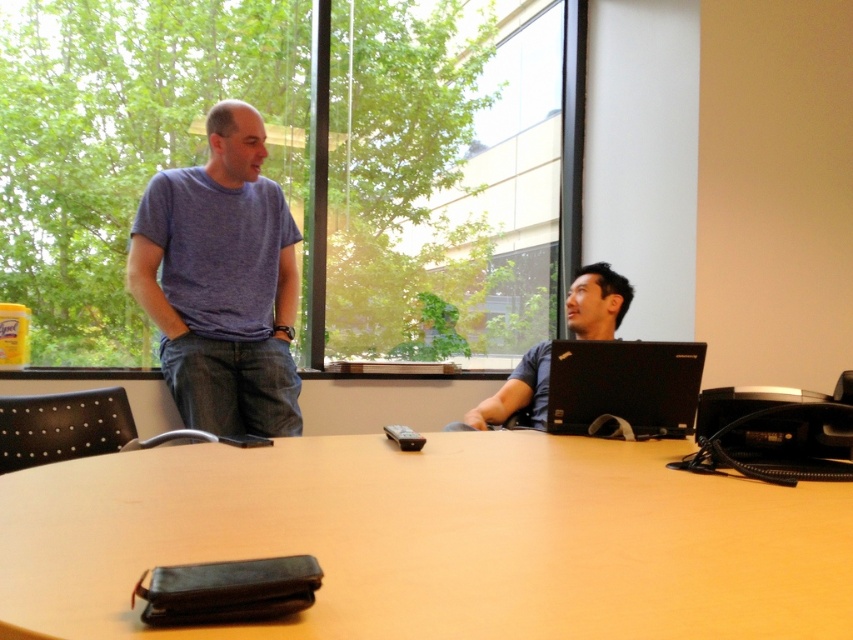
You are organizing a meeting in the room and need to place a new document folder on the table. The document folder must be placed between the black matte laptop at right and the matte black laptop at right. Is this possible?

The black matte laptop at right is positioned under the matte black laptop at right, meaning they are stacked or one is covering the other. Therefore, there is no space between them to place the document folder.

You are standing in the room and want to place a new item at coordinate point 0.603, 0.733. Is there already an object at that location? Please check the black matte laptop at right.

Yes, the black matte laptop at right is already positioned at coordinate point [624,385].

You are a delivery person who needs to place a package on the light brown wooden table at center. However, there is a transparent glass window at upper center above the table. Will the window interfere with placing the package on the table?

→ The transparent glass window at upper center is positioned over the light brown wooden table at center, so placing the package might be obstructed by the window if it hangs too low. Check the window clearance before placing the package.